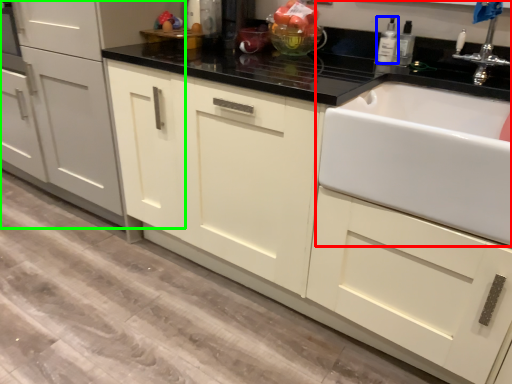
Question: Which object is positioned closest to sink (highlighted by a red box)? Select from bottle (highlighted by a blue box) and cabinetry (highlighted by a green box).

Choices:
 (A) bottle
 (B) cabinetry

Answer: (A)